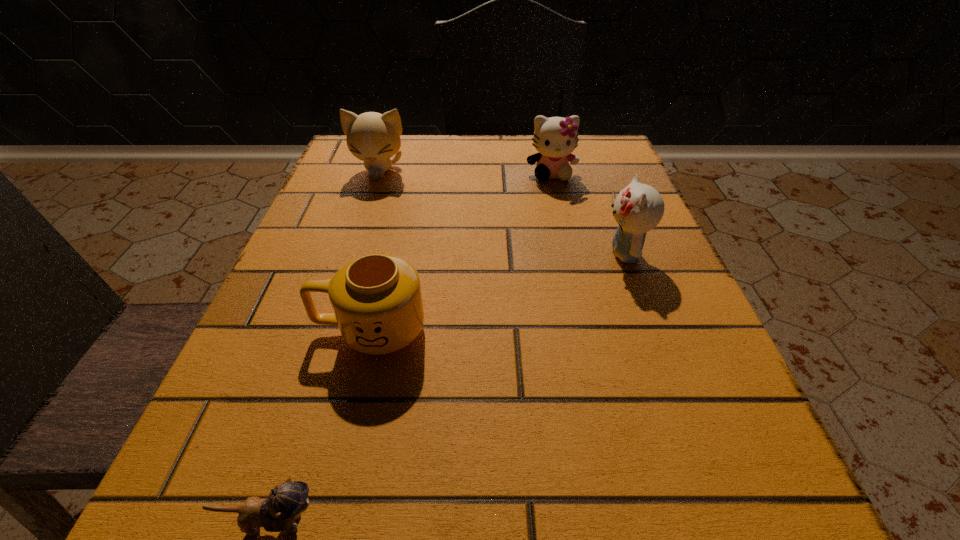
The height and width of the screenshot is (540, 960). Identify the location of object situated at the far right corner. (555, 138).

This screenshot has width=960, height=540. I want to click on free space at the far edge, so click(x=444, y=154).

Locate an element on the screen. The width and height of the screenshot is (960, 540). vacant space at the near edge of the desktop is located at coordinates (494, 511).

This screenshot has height=540, width=960. In order to click on vacant region at the left edge in this screenshot , I will do (x=383, y=253).

You are a GUI agent. You are given a task and a screenshot of the screen. Output one action in this format:
    pyautogui.click(x=<x>, y=<y>)
    Task: Click on the vacant region at the right edge
    This screenshot has height=540, width=960.
    Given the screenshot: What is the action you would take?
    pyautogui.click(x=732, y=458)

I want to click on vacant region at the near right corner of the desktop, so click(764, 506).

Find the location of a particular element. This screenshot has width=960, height=540. object that is the third closest one to the shortest kitten is located at coordinates (374, 138).

Image resolution: width=960 pixels, height=540 pixels. I want to click on object that is the third closest to the fourth farthest object, so click(x=374, y=138).

Locate an element on the screen. the second closest kitten to the nearest object is located at coordinates (374, 138).

This screenshot has height=540, width=960. I want to click on kitten that is the third closest to the third farthest kitten, so click(x=285, y=503).